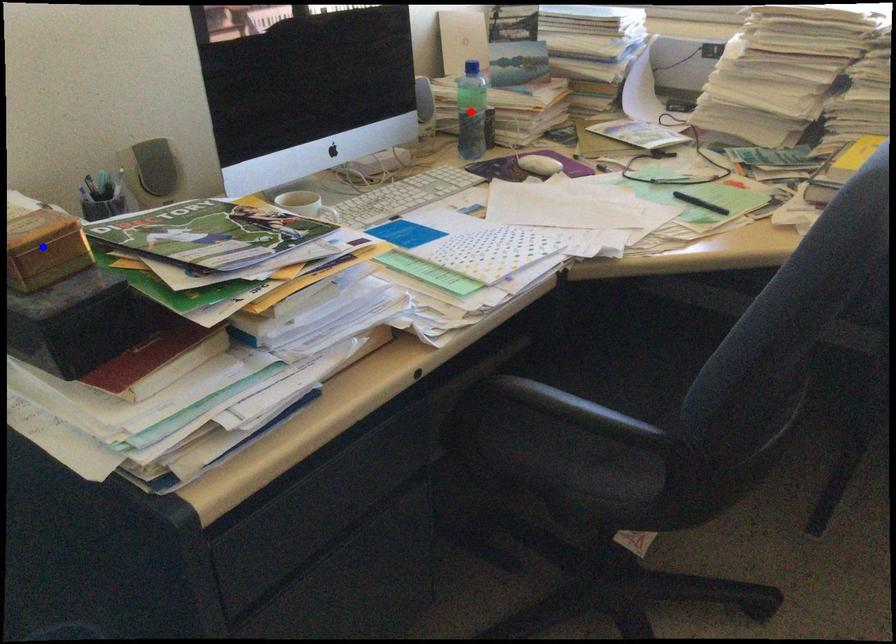
Question: Which of the two points in the image is closer to the camera?

Choices:
 (A) Blue point is closer.
 (B) Red point is closer.

Answer: (A)